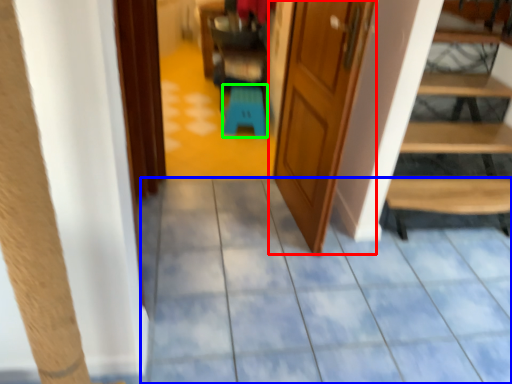
Question: Considering the real-world distances, which object is closest to door (highlighted by a red box)? path (highlighted by a blue box) or stool (highlighted by a green box).

Choices:
 (A) path
 (B) stool

Answer: (A)